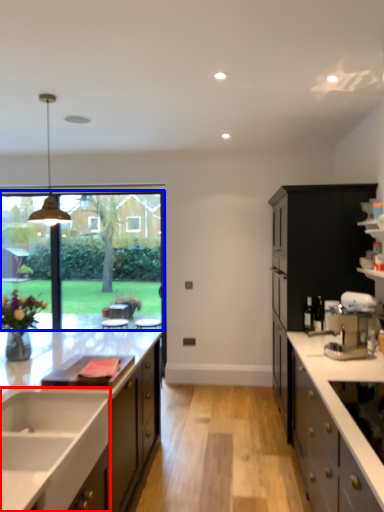
Question: Which object appears closest to the camera in this image, sink (highlighted by a red box) or window screen (highlighted by a blue box)?

Choices:
 (A) sink
 (B) window screen

Answer: (A)